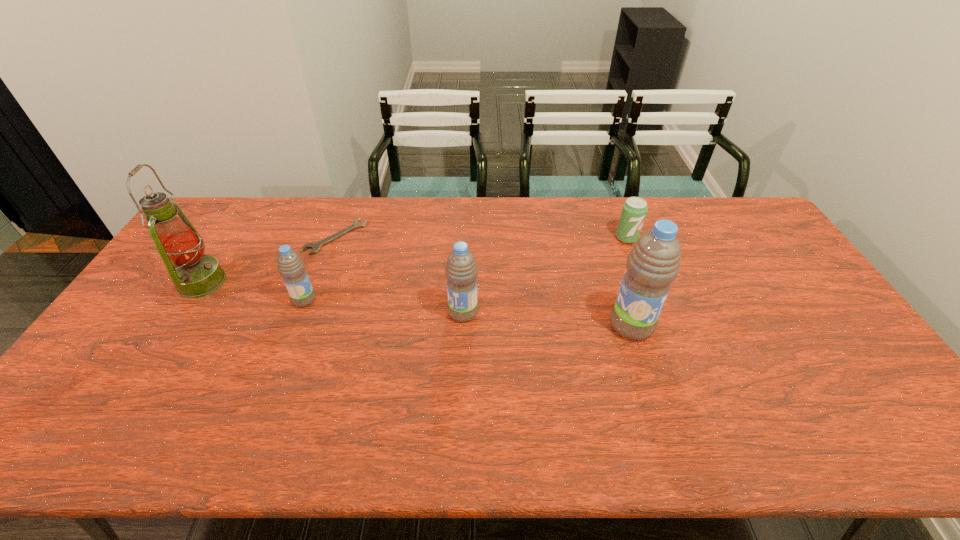
Please point out where to position a new water bottle on the right to maintain spacing. Please provide its 2D coordinates. Your answer should be formatted as a tuple, i.e. [(x, y)], where the tuple contains the x and y coordinates of a point satisfying the conditions above.

[(809, 340)]